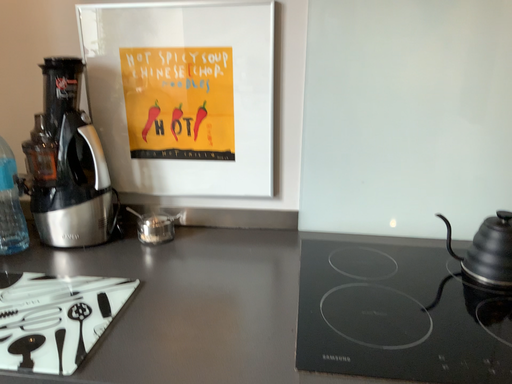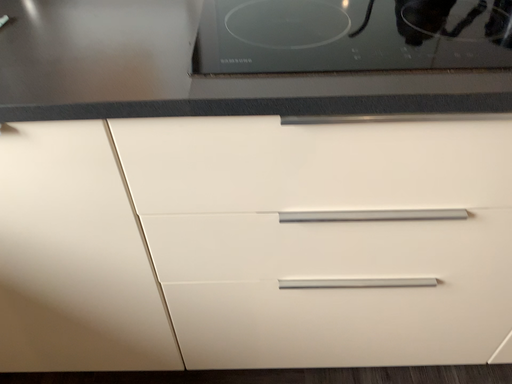
Question: Which way did the camera rotate in the video?

Choices:
 (A) rotated right
 (B) rotated left

Answer: (A)